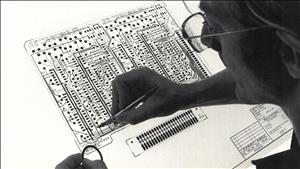
Identify the location of cord. (89, 160).